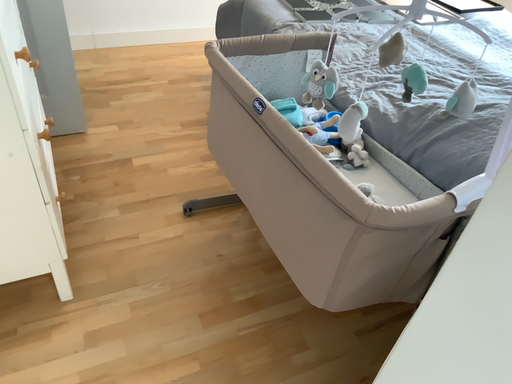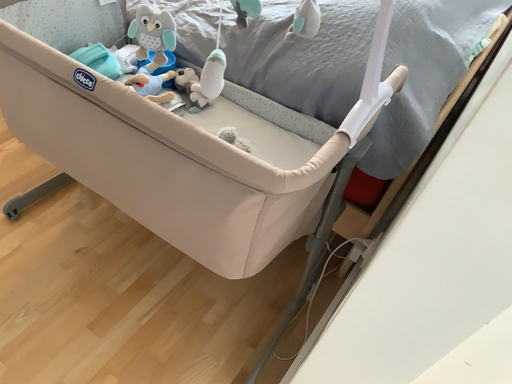
Question: How did the camera likely rotate when shooting the video?

Choices:
 (A) rotated right
 (B) rotated left

Answer: (A)